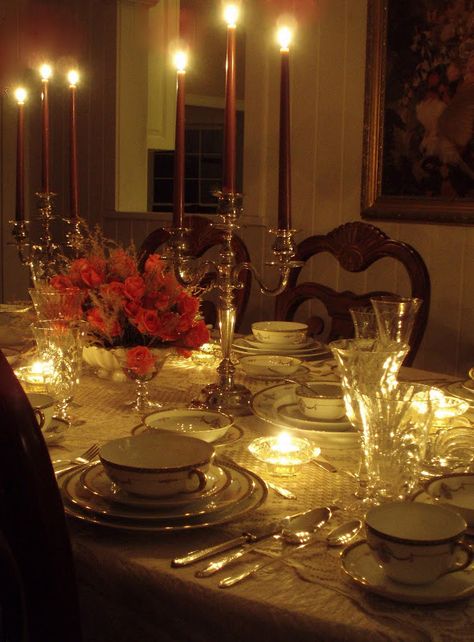
Where is `plates`? This screenshot has height=642, width=474. plates is located at coordinates (101, 488), (79, 489), (71, 510), (363, 578), (422, 497), (298, 411), (264, 411), (308, 345), (315, 347), (323, 351).